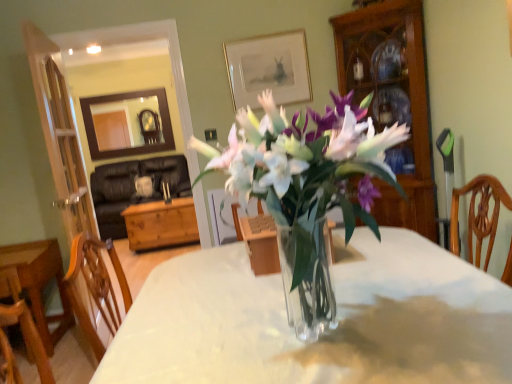
I want to click on vacant space behind clear glass vase at center, so click(x=331, y=272).